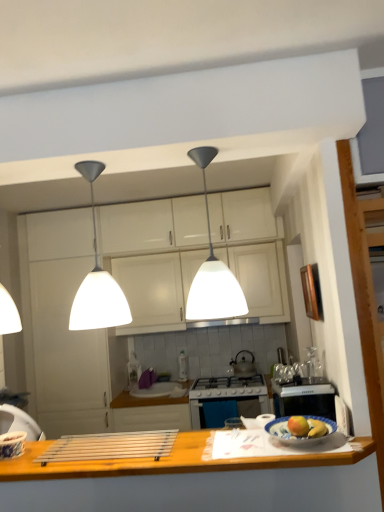
Locate an element on the screen. This screenshot has width=384, height=512. vacant space underneath white matte pendant light at center, positioned as the first light in right-to-left order (from a real-world perspective) is located at coordinates (235, 443).